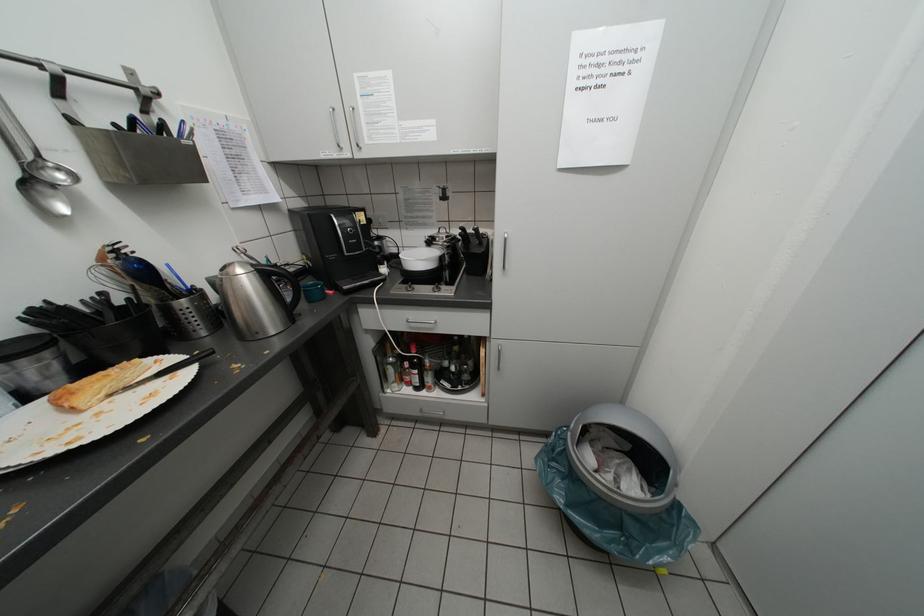
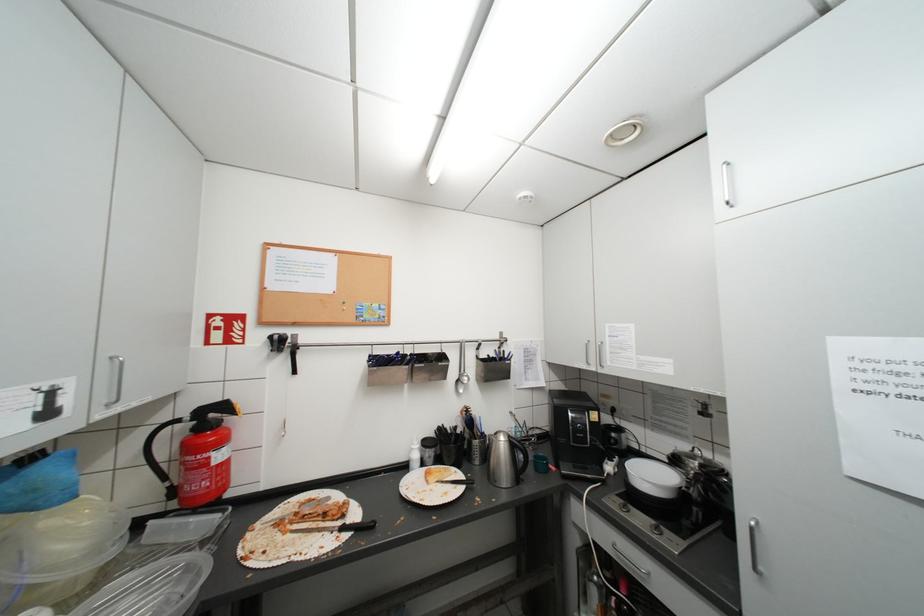
The first image is from the beginning of the video and the second image is from the end. How did the camera likely rotate when shooting the video?

The camera's rotation is toward left-up.